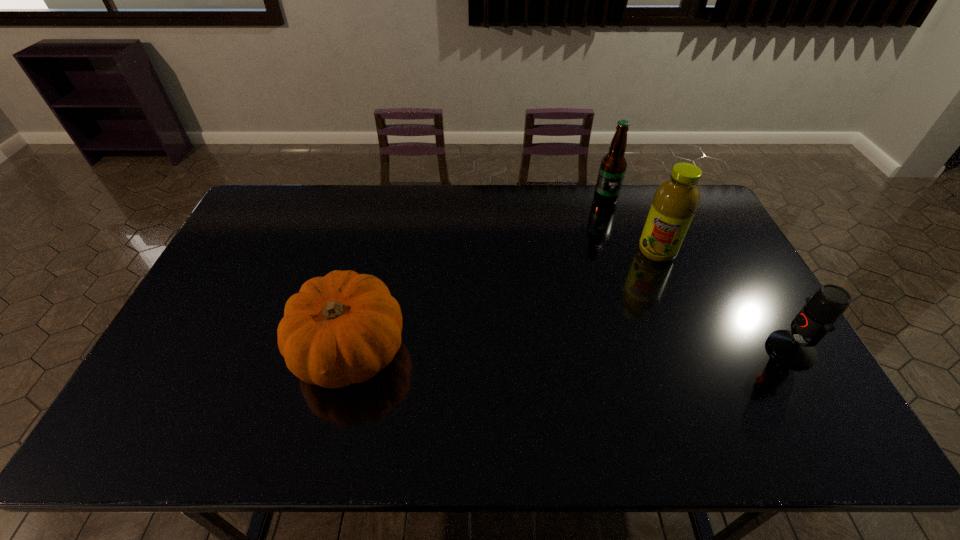
Locate an element on the screen. This screenshot has height=540, width=960. pumpkin is located at coordinates (343, 328).

This screenshot has width=960, height=540. I want to click on microphone, so click(817, 318).

Find the location of a particular element. fruit juice is located at coordinates (676, 200).

I want to click on the second farthest object, so click(676, 200).

The width and height of the screenshot is (960, 540). In order to click on the farthest object in this screenshot , I will do [613, 165].

Where is `beer bottle`? Image resolution: width=960 pixels, height=540 pixels. beer bottle is located at coordinates (613, 165).

Identify the location of vacant region located 0.160m on the left of the pumpkin. The width and height of the screenshot is (960, 540). (234, 350).

I want to click on free region located on the side of the rightmost object with the red ring, so click(674, 350).

Locate an element on the screen. blank space located 0.060m on the side of the rightmost object with the red ring is located at coordinates (746, 350).

Locate an element on the screen. The height and width of the screenshot is (540, 960). vacant space located 0.120m on the side of the rightmost object with the red ring is located at coordinates (723, 350).